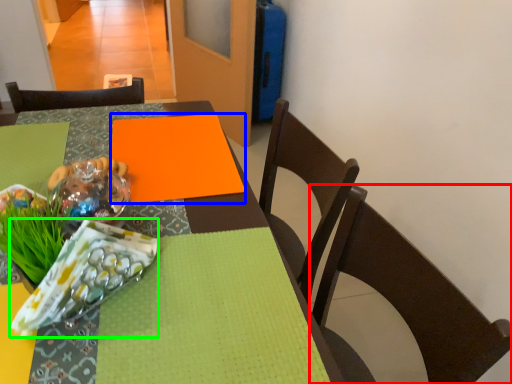
Question: Which object is the closest to the chair (highlighted by a red box)? Choose among these: linen (highlighted by a blue box) or material (highlighted by a green box).

Choices:
 (A) linen
 (B) material

Answer: (A)